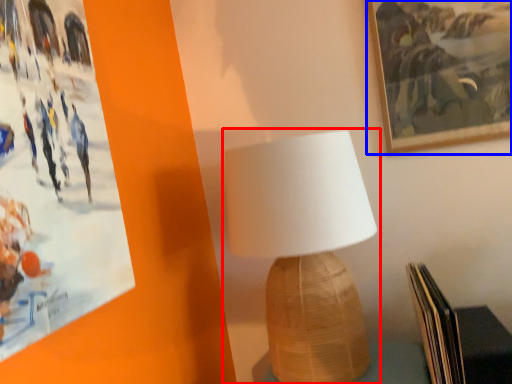
Question: Which of the following is the farthest to the observer, lamp (highlighted by a red box) or picture frame (highlighted by a blue box)?

Choices:
 (A) lamp
 (B) picture frame

Answer: (B)